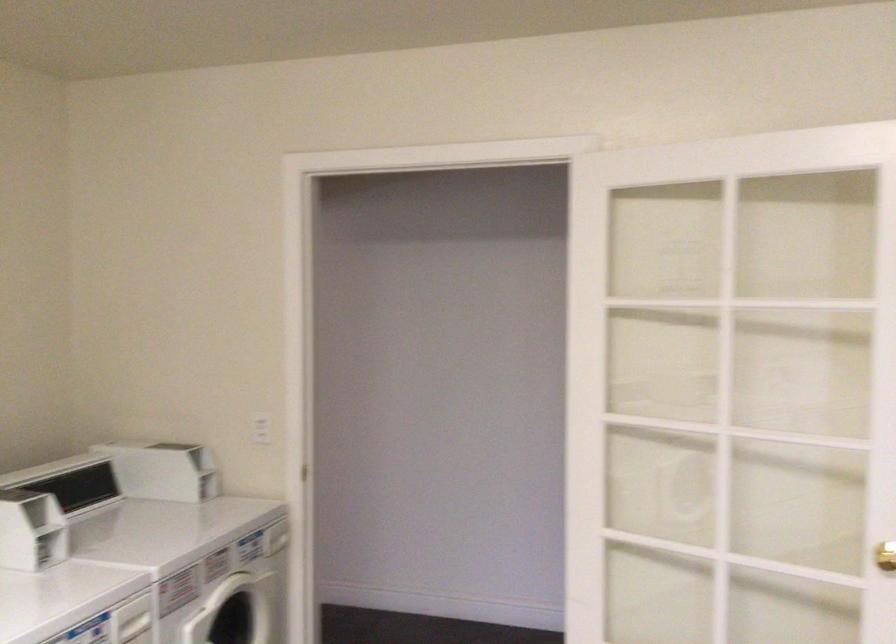
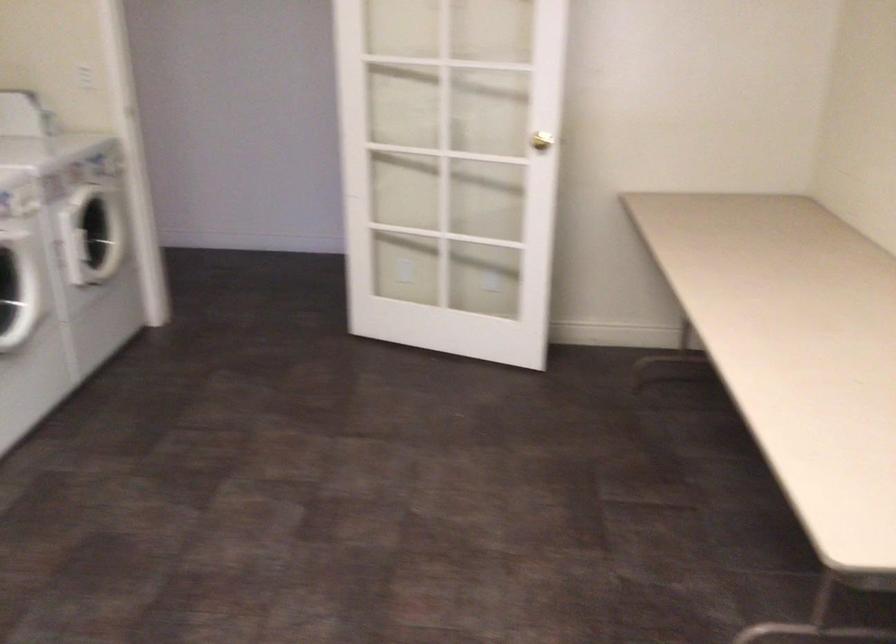
The first image is from the beginning of the video and the second image is from the end. How did the camera likely rotate when shooting the video?

A: The camera's rotation is toward right-down.